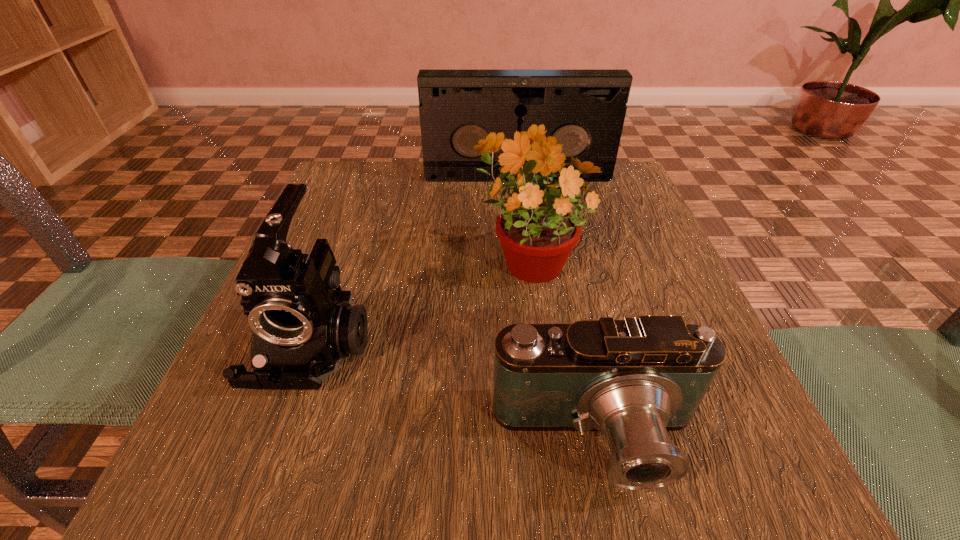
Find the location of a particular element. object that stands as the third closest to the left camcorder is located at coordinates coord(588,107).

At what (x,y) coordinates should I click in order to perform the action: click on object that can be found as the closest to the videotape. Please return your answer as a coordinate pair (x, y). This screenshot has height=540, width=960. Looking at the image, I should click on (537, 227).

Where is `blank space that satisfies the following two spatial constraints: 1. on the front side of the flowerpot; 2. on the right side of the videotape`? This screenshot has width=960, height=540. blank space that satisfies the following two spatial constraints: 1. on the front side of the flowerpot; 2. on the right side of the videotape is located at coordinates (528, 258).

Identify the location of free location that satisfies the following two spatial constraints: 1. on the front side of the flowerpot; 2. on the left side of the videotape. (528, 258).

The image size is (960, 540). I want to click on vacant space that satisfies the following two spatial constraints: 1. on the front side of the videotape; 2. on the left side of the second farthest object, so click(x=528, y=258).